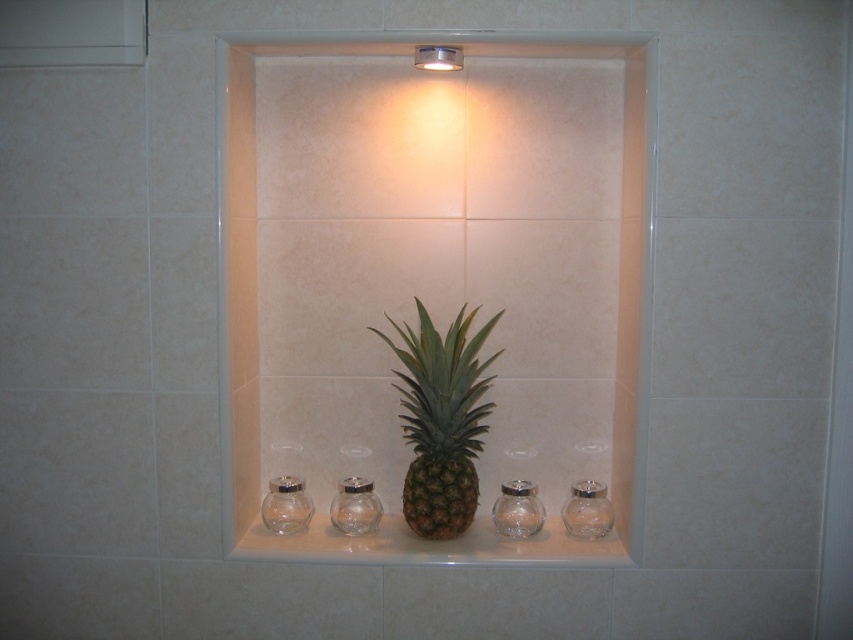
You are designing a display for a tropical theme. You have a green matte pineapple at center and clear glass jar at center. Which object should you choose if you want the central piece to be the focal point due to its size?

The green matte pineapple at center is larger in size than the clear glass jar at center, so it would naturally draw more attention as the focal point in the tropical display.

You are organizing a display in the niche and need to place a small decorative item. You have a choice between placing it in the transparent glass jar at lower right or the transparent glass jar at center. Which jar offers more space for the item?

The transparent glass jar at lower right is bigger than the transparent glass jar at center, so it offers more space for the decorative item.

You are organizing a display in the niche and need to place a decorative item between the transparent glass jar at lower right and the transparent glass jar at center. Based on their positions, where should you place the new item?

You should place the new item to the left of the transparent glass jar at lower right because it is to the right of the transparent glass jar at center, so the space between them is on the left side of the lower right jar.